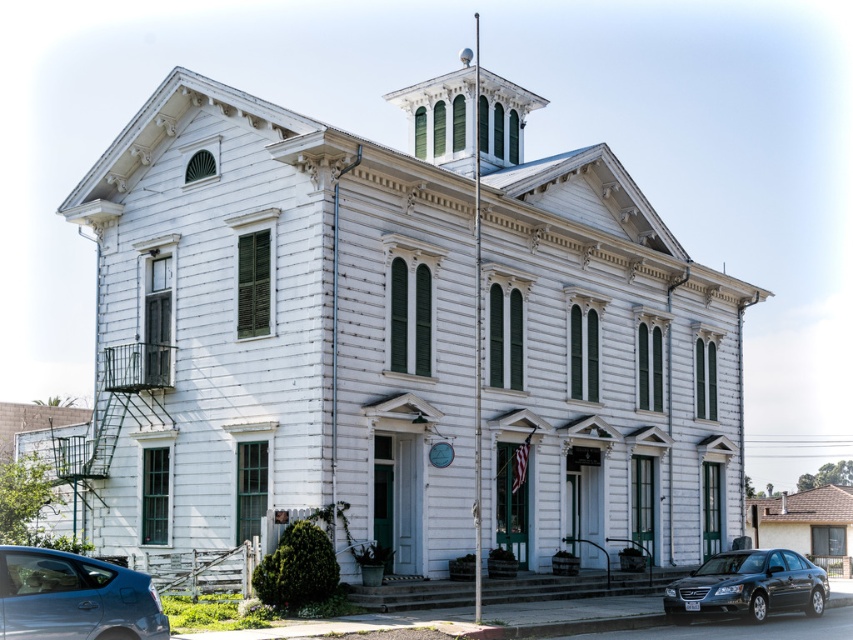
Question: Is the position of metallic blue sedan at lower left less distant than that of shiny black sedan at lower right?

Choices:
 (A) yes
 (B) no

Answer: (A)

Question: Which of the following is the farthest from the observer?

Choices:
 (A) (85, 616)
 (B) (741, 570)

Answer: (B)

Question: Where is metallic blue sedan at lower left located in relation to shiny black sedan at lower right in the image?

Choices:
 (A) below
 (B) above

Answer: (B)

Question: Is metallic blue sedan at lower left wider than shiny black sedan at lower right?

Choices:
 (A) yes
 (B) no

Answer: (B)

Question: Which point is closer to the camera taking this photo?

Choices:
 (A) (675, 600)
 (B) (71, 621)

Answer: (B)